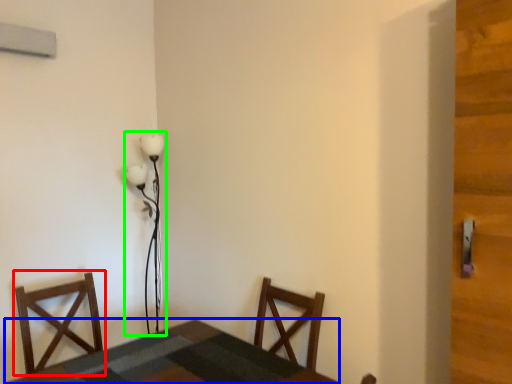
Question: Which object is positioned closest to chair (highlighted by a red box)? Select from table (highlighted by a blue box) and lamp (highlighted by a green box).

Choices:
 (A) table
 (B) lamp

Answer: (A)